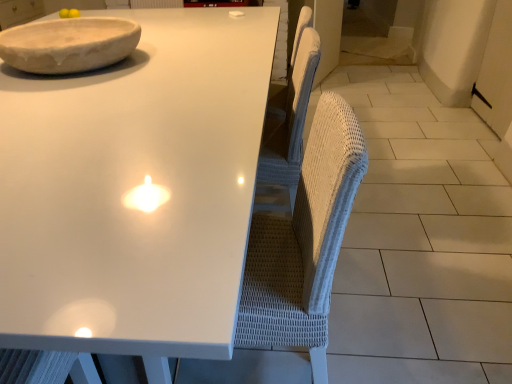
Question: Is white glossy table at upper center inside or outside of white wicker swivel chair at center?

Choices:
 (A) inside
 (B) outside

Answer: (B)

Question: From their relative heights in the image, would you say white glossy table at upper center is taller or shorter than white wicker swivel chair at center?

Choices:
 (A) short
 (B) tall

Answer: (A)

Question: Which is farther from the white marble bowl at upper left?

Choices:
 (A) white wicker swivel chair at center
 (B) white glossy table at upper center

Answer: (A)

Question: Which object is the farthest from the white glossy table at upper center?

Choices:
 (A) white wicker swivel chair at center
 (B) white marble bowl at upper left

Answer: (A)